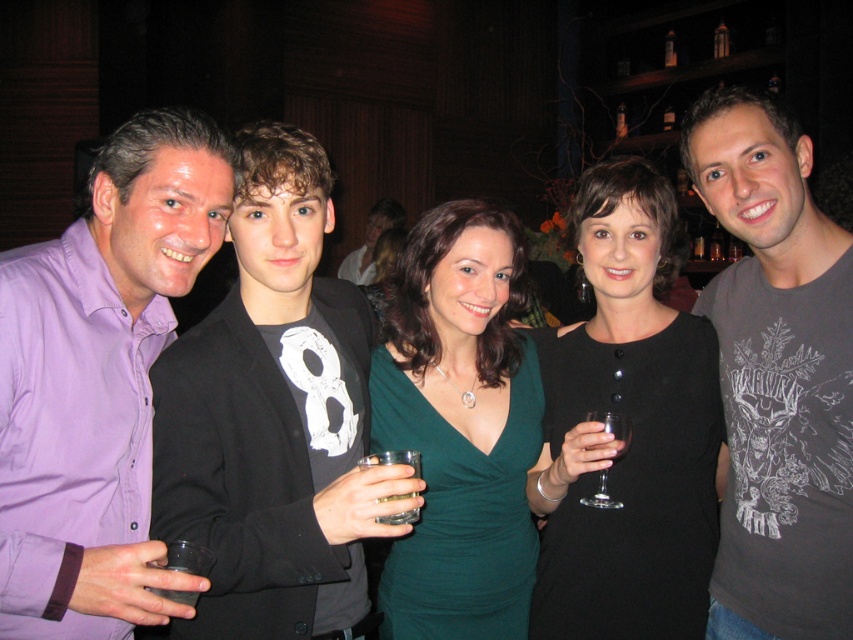
Is matte black blazer at left smaller than purple shirt at left?

Actually, matte black blazer at left might be larger than purple shirt at left.

At what (x,y) coordinates should I click in order to perform the action: click on matte black blazer at left. Please return your answer as a coordinate pair (x, y). The width and height of the screenshot is (853, 640). Looking at the image, I should click on (271, 416).

Does point (314, 492) lie behind point (190, 134)?

Yes, point (314, 492) is behind point (190, 134).

The height and width of the screenshot is (640, 853). What are the coordinates of `matte black blazer at left` in the screenshot? It's located at (271, 416).

Is matte black blazer at left to the right of black matte dress at center from the viewer's perspective?

In fact, matte black blazer at left is to the left of black matte dress at center.

Image resolution: width=853 pixels, height=640 pixels. Identify the location of matte black blazer at left. (271, 416).

Where is `matte black blazer at left`? matte black blazer at left is located at coordinates (271, 416).

Image resolution: width=853 pixels, height=640 pixels. What do you see at coordinates (460, 512) in the screenshot? I see `green satin dress at center` at bounding box center [460, 512].

Is green satin dress at center further to the viewer compared to clear plastic cup at lower left?

Yes.

Who is more distant from viewer, (459, 573) or (167, 589)?

Point (459, 573)

This screenshot has height=640, width=853. Find the location of `green satin dress at center`. green satin dress at center is located at coordinates (460, 512).